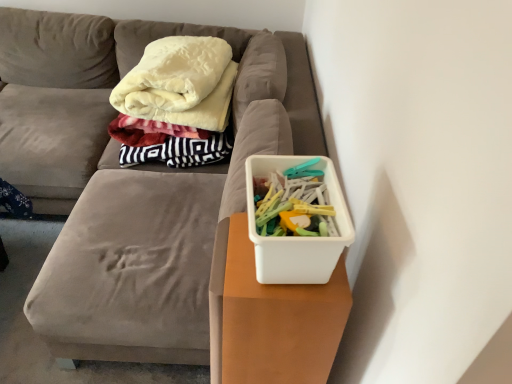
Question: Is white plastic container at right facing away from white plastic container at center?

Choices:
 (A) yes
 (B) no

Answer: (B)

Question: From the image's perspective, does white plastic container at right appear lower than white plastic container at center?

Choices:
 (A) yes
 (B) no

Answer: (A)

Question: Is white plastic container at right thinner than white plastic container at center?

Choices:
 (A) no
 (B) yes

Answer: (B)

Question: Is white plastic container at right further to camera compared to white plastic container at center?

Choices:
 (A) yes
 (B) no

Answer: (B)

Question: Does white plastic container at right have a lesser height compared to white plastic container at center?

Choices:
 (A) no
 (B) yes

Answer: (B)

Question: Considering the relative sizes of white plastic container at right and white plastic container at center in the image provided, is white plastic container at right bigger than white plastic container at center?

Choices:
 (A) no
 (B) yes

Answer: (A)

Question: Is white plastic container at center smaller than white plastic container at right?

Choices:
 (A) no
 (B) yes

Answer: (A)

Question: Does white plastic container at center lie in front of white plastic container at right?

Choices:
 (A) yes
 (B) no

Answer: (B)

Question: Is white plastic container at center turned away from white plastic container at right?

Choices:
 (A) no
 (B) yes

Answer: (A)

Question: Is white plastic container at center not close to white plastic container at right?

Choices:
 (A) no
 (B) yes

Answer: (A)

Question: Does white plastic container at center have a larger size compared to white plastic container at right?

Choices:
 (A) no
 (B) yes

Answer: (B)

Question: Does white plastic container at center have a greater height compared to white plastic container at right?

Choices:
 (A) no
 (B) yes

Answer: (B)

Question: Could you tell me if white plastic container at center is facing white plastic container at right?

Choices:
 (A) no
 (B) yes

Answer: (A)